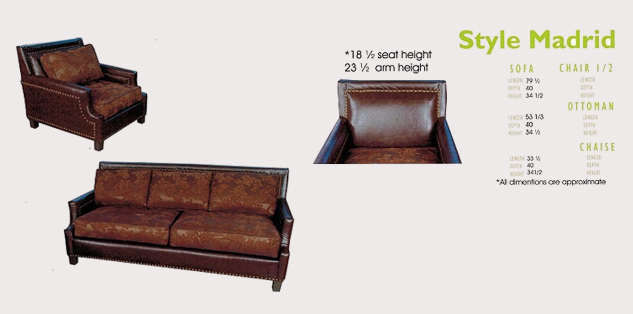
The height and width of the screenshot is (314, 633). Identify the location of left chair arm. (123, 72), (453, 156).